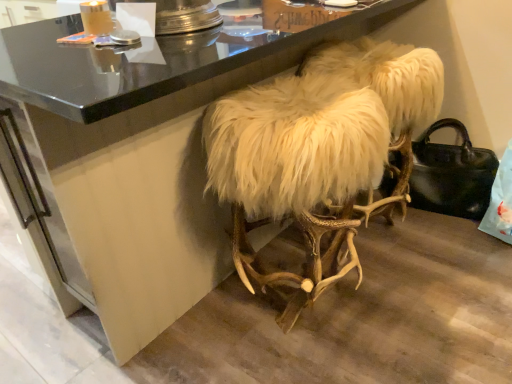
The image size is (512, 384). What do you see at coordinates (320, 150) in the screenshot? I see `white fluffy stool at center` at bounding box center [320, 150].

You are a GUI agent. You are given a task and a screenshot of the screen. Output one action in this format:
    pyautogui.click(x=<x>, y=<y>)
    Task: Click on the white fluffy stool at center
    The image size is (512, 384).
    Given the screenshot: What is the action you would take?
    pyautogui.click(x=320, y=150)

This screenshot has height=384, width=512. In order to click on white fluffy stool at center in this screenshot , I will do `click(320, 150)`.